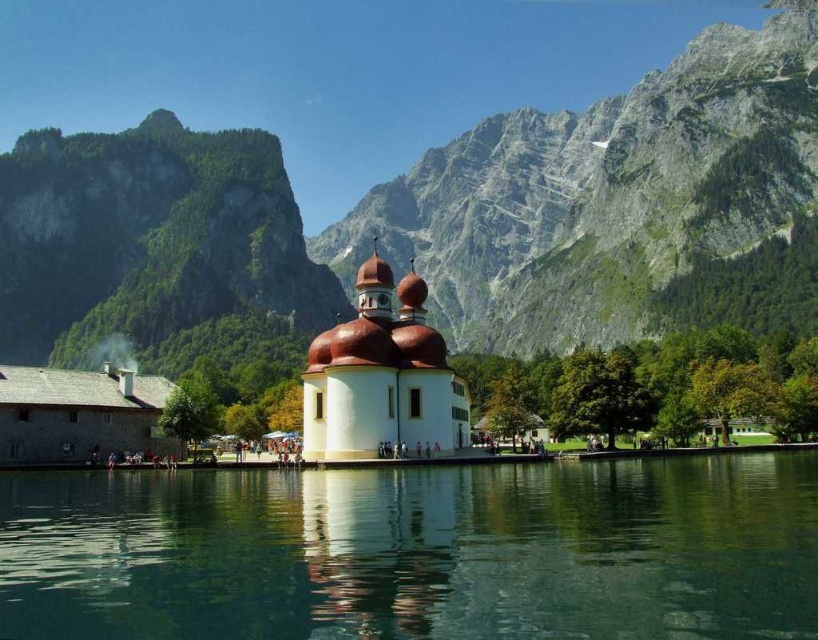
Question: Which of the following is the closest to the observer?

Choices:
 (A) pos(7,237)
 (B) pos(142,492)

Answer: (B)

Question: Is clear water at lower center smaller than white smooth chapel at center?

Choices:
 (A) no
 (B) yes

Answer: (A)

Question: Does granite rock formation at upper center appear on the left side of white smooth chapel at center?

Choices:
 (A) no
 (B) yes

Answer: (B)

Question: Considering the real-world distances, which object is closest to the granite rock formation at upper center?

Choices:
 (A) clear water at lower center
 (B) white smooth chapel at center

Answer: (A)

Question: Which of the following is the closest to the observer?

Choices:
 (A) white smooth chapel at center
 (B) granite rock formation at upper center

Answer: (A)

Question: Does granite rock formation at upper center appear over clear water at lower center?

Choices:
 (A) no
 (B) yes

Answer: (B)